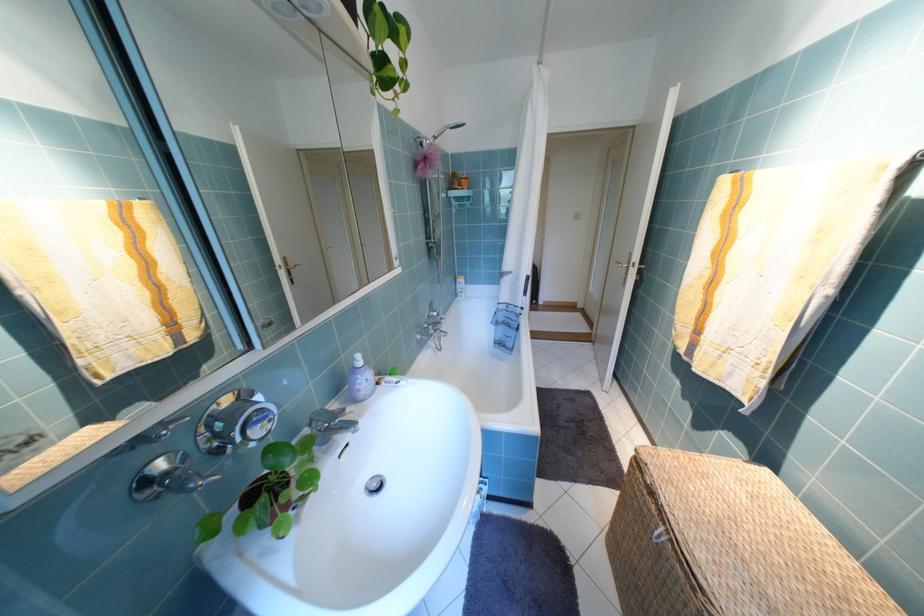
Identify the location of orange bottle. (464, 180).